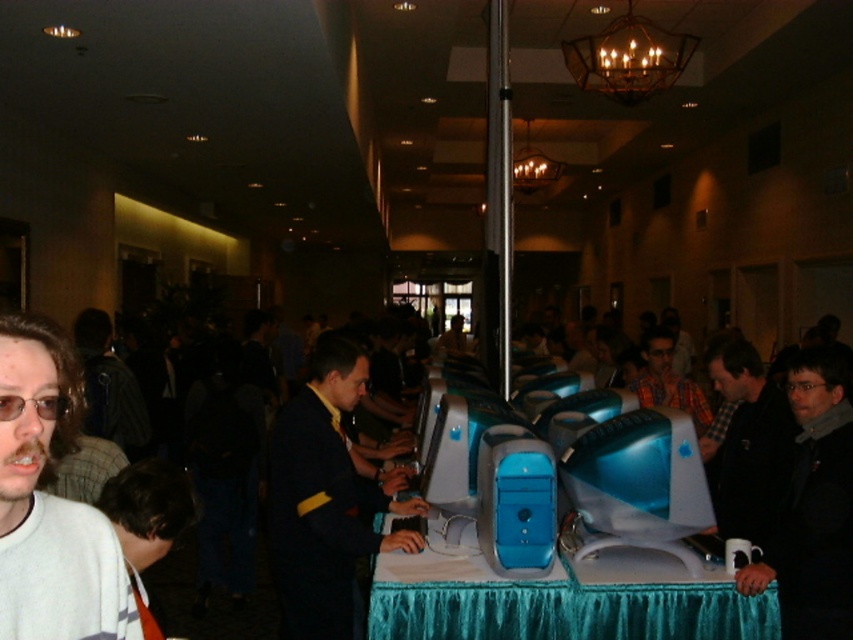
You are standing in the conference room and see two points marked in the image. Which point, point (10, 333) or point (772, 483), is closer to you?

Point (10, 333) is closer to the viewer than point (772, 483).

You are standing in the conference room and want to reach the dark blue suit at center. However, there is a teal fabric table at center in your way. Can you walk around it to get to the suit?

The teal fabric table at center is closer to the viewer than the dark blue suit at center, so you can walk around the teal fabric table at center to reach the dark blue suit at center.

You are standing in the conference room and want to reach the point marked as point [802,611]. If you can walk 3 feet per second, how many seconds will it take you to reach that point?

The distance between you and point [802,611] is 8.42 feet. At a walking speed of 3 feet per second, it will take approximately 2.81 seconds to reach the point.